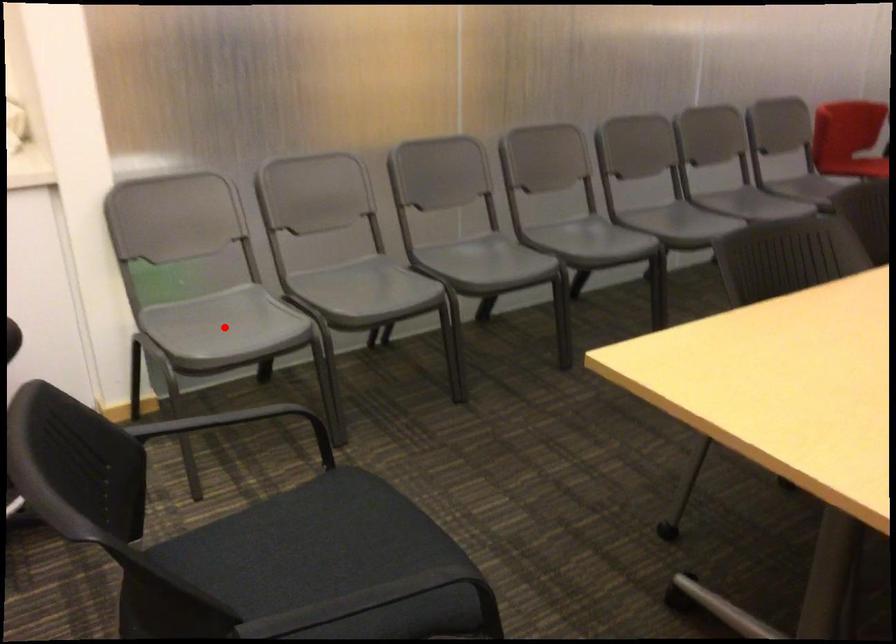
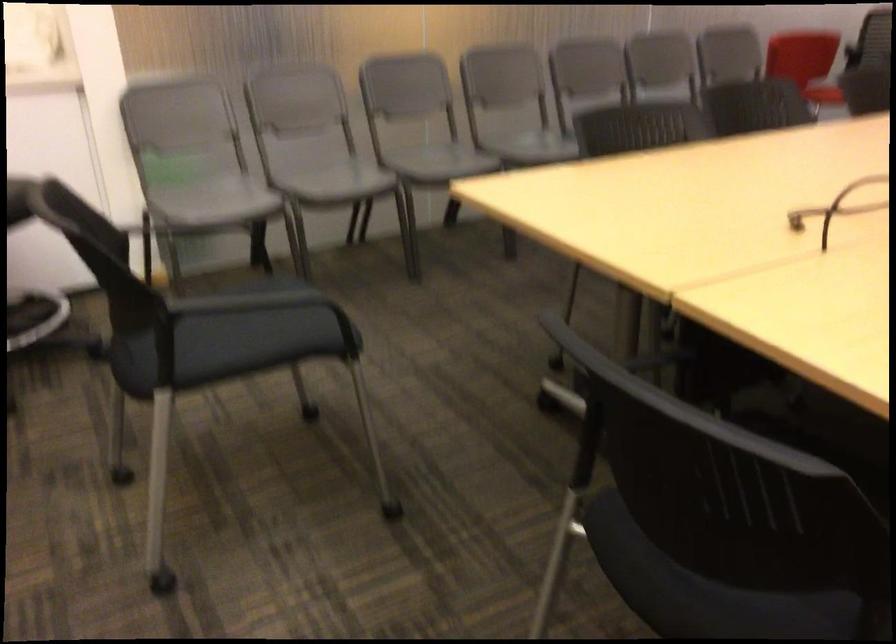
Question: I am providing you with two images of the same scene from different viewpoints. In image1, a red point is highlighted. Considering the same 3D point in image2, which of the following is correct?

Choices:
 (A) It is closer
 (B) It is farther

Answer: (B)